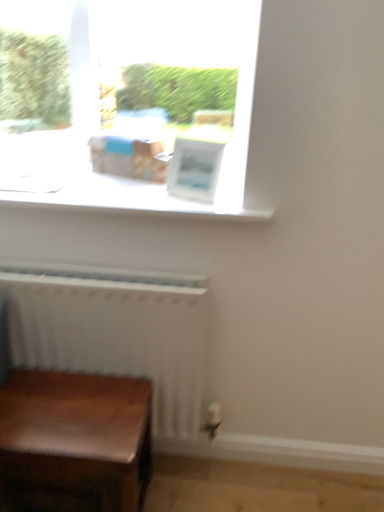
Question: Is white matte radiator at lower left positioned before wooden table at lower left?

Choices:
 (A) no
 (B) yes

Answer: (A)

Question: Is white matte radiator at lower left shorter than wooden table at lower left?

Choices:
 (A) no
 (B) yes

Answer: (A)

Question: Can you confirm if white matte radiator at lower left is bigger than wooden table at lower left?

Choices:
 (A) no
 (B) yes

Answer: (B)

Question: Is white matte radiator at lower left positioned with its back to wooden table at lower left?

Choices:
 (A) yes
 (B) no

Answer: (A)

Question: Does white matte radiator at lower left have a greater height compared to wooden table at lower left?

Choices:
 (A) no
 (B) yes

Answer: (B)

Question: From a real-world perspective, is white matte radiator at lower left physically below wooden table at lower left?

Choices:
 (A) yes
 (B) no

Answer: (B)

Question: From a real-world perspective, is white matte window sill at upper center on wooden table at lower left?

Choices:
 (A) no
 (B) yes

Answer: (B)

Question: Does white matte window sill at upper center have a lesser width compared to wooden table at lower left?

Choices:
 (A) no
 (B) yes

Answer: (A)

Question: From the image's perspective, would you say white matte window sill at upper center is positioned over wooden table at lower left?

Choices:
 (A) yes
 (B) no

Answer: (A)

Question: Can you confirm if white matte window sill at upper center is wider than wooden table at lower left?

Choices:
 (A) no
 (B) yes

Answer: (B)

Question: Considering the relative sizes of white matte window sill at upper center and wooden table at lower left in the image provided, is white matte window sill at upper center smaller than wooden table at lower left?

Choices:
 (A) yes
 (B) no

Answer: (A)

Question: Can you confirm if white matte window sill at upper center is positioned to the right of wooden table at lower left?

Choices:
 (A) yes
 (B) no

Answer: (A)

Question: Is wooden table at lower left not close to white matte radiator at lower left?

Choices:
 (A) no
 (B) yes

Answer: (A)